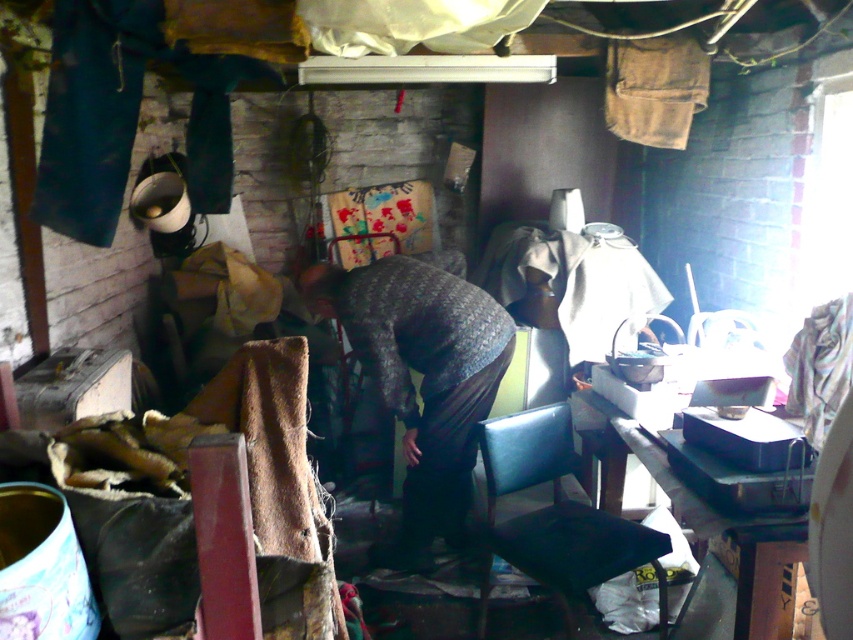
You are standing in the cluttered indoor space and want to move from point A to point B. Point A is at coordinate point (453, 378) and point B is at coordinate point (598, 442). Which point is closer to you?

Point A at coordinate point (453, 378) is closer to you because it is further to the viewer than point B at coordinate point (598, 442).

Consider the image. Where is the knitted fabric sweater at center located in the image?

The knitted fabric sweater at center is located at the point with coordinates 0.591 on the x axis and 0.496 on the y axis.

You are a delivery person who needs to place a large package on the black plastic table at lower right. However, the black leather chair at lower center is blocking the way. Can you move the chair to access the table?

The black plastic table at lower right is behind the black leather chair at lower center, so you need to move the black leather chair at lower center to access the table.